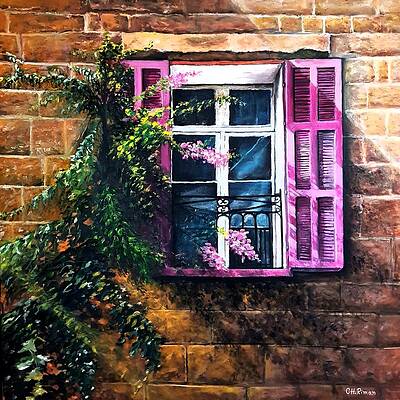
I want to click on spot above window, so click(227, 42).